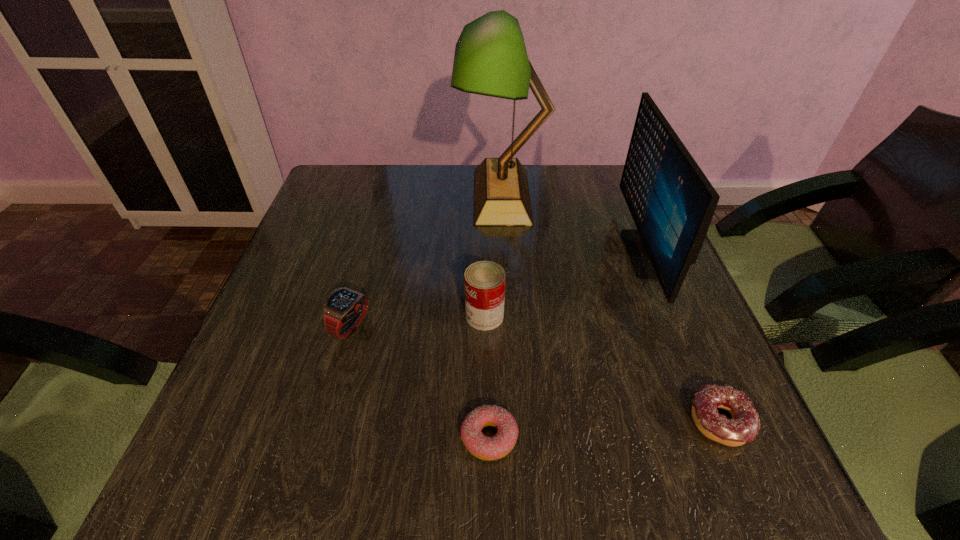
You are a GUI agent. You are given a task and a screenshot of the screen. Output one action in this format:
    pyautogui.click(x=<x>, y=<y>)
    Task: Click on the free space located 0.240m on the metallic stand of the table lamp
    The width and height of the screenshot is (960, 540).
    Given the screenshot: What is the action you would take?
    pyautogui.click(x=371, y=196)

The height and width of the screenshot is (540, 960). I want to click on free space located on the metallic stand of the table lamp, so click(x=345, y=196).

Locate an element on the screen. vacant space located 0.340m on the screen side of the computer monitor is located at coordinates click(x=483, y=253).

The height and width of the screenshot is (540, 960). Find the location of `free space located on the screen side of the computer monitor`. free space located on the screen side of the computer monitor is located at coordinates (499, 253).

The image size is (960, 540). Find the location of `vacant space located on the screen side of the computer monitor`. vacant space located on the screen side of the computer monitor is located at coordinates (568, 253).

What are the coordinates of `vacant space positioned 0.210m on the front label of the can` in the screenshot? It's located at (362, 316).

Identify the location of free spot located on the front label of the can. (351, 316).

Identify the location of vacant space positioned 0.190m on the front label of the can. This screenshot has height=540, width=960. (372, 316).

The width and height of the screenshot is (960, 540). Find the location of `free region located 0.120m on the right of the watch`. free region located 0.120m on the right of the watch is located at coordinates (430, 326).

Find the location of a particular element. This screenshot has height=540, width=960. free space located on the left of the fifth tallest object is located at coordinates (611, 421).